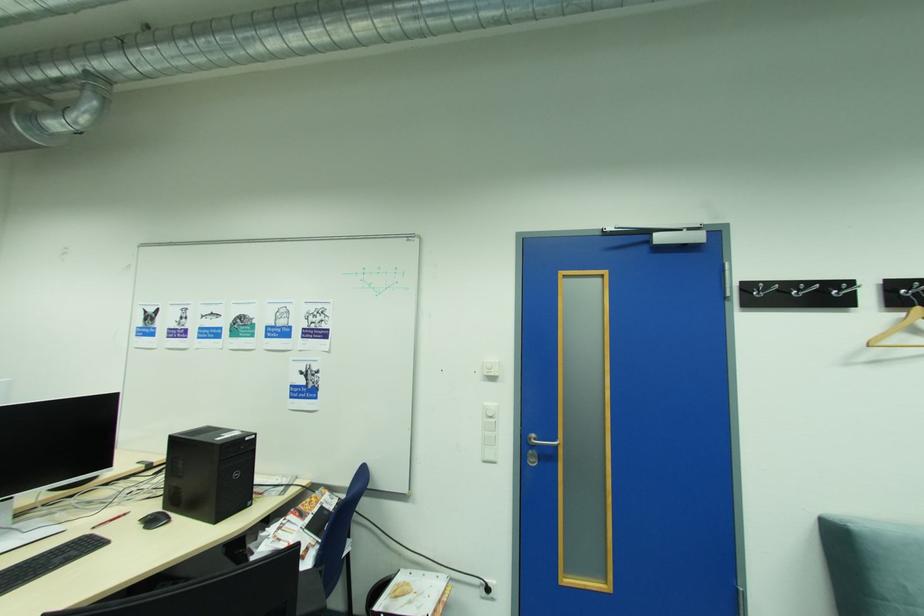
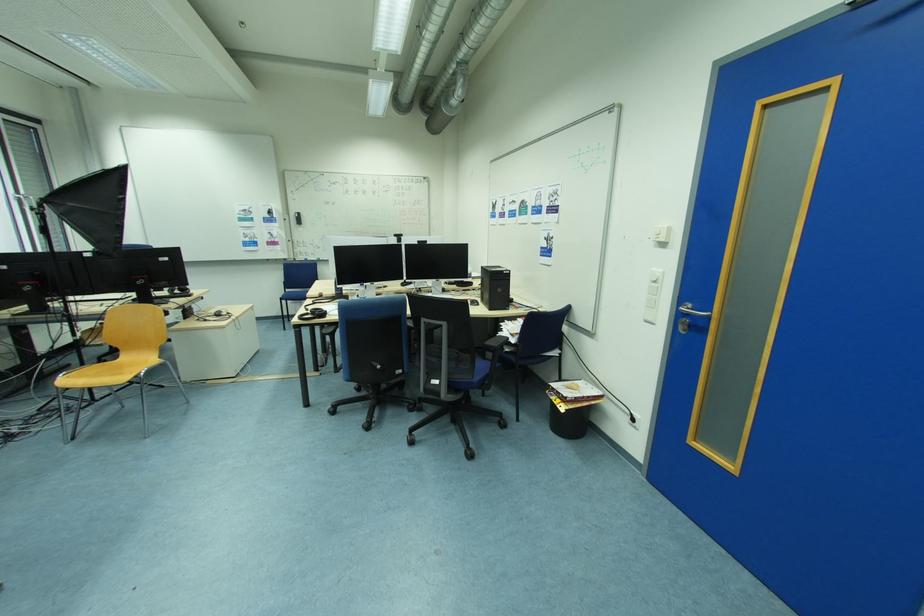
The point at (160, 522) is marked in the first image. Where is the corresponding point in the second image?

(480, 304)